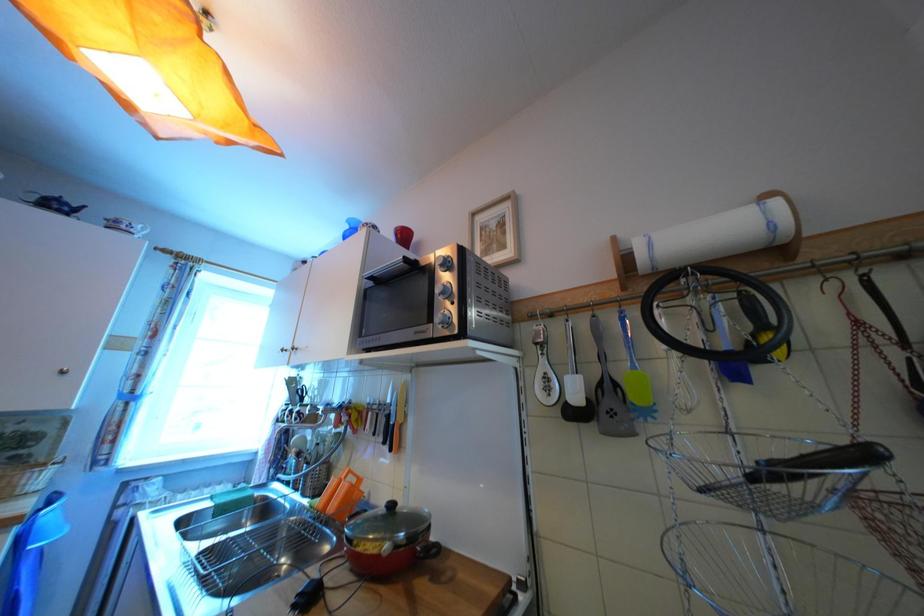
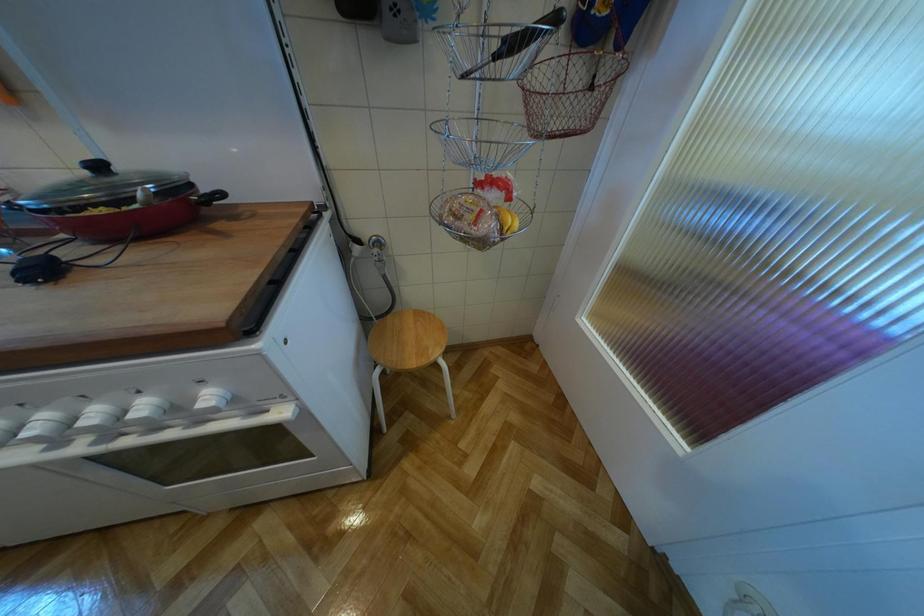
How did the camera likely rotate?

The camera rotated toward right-down.